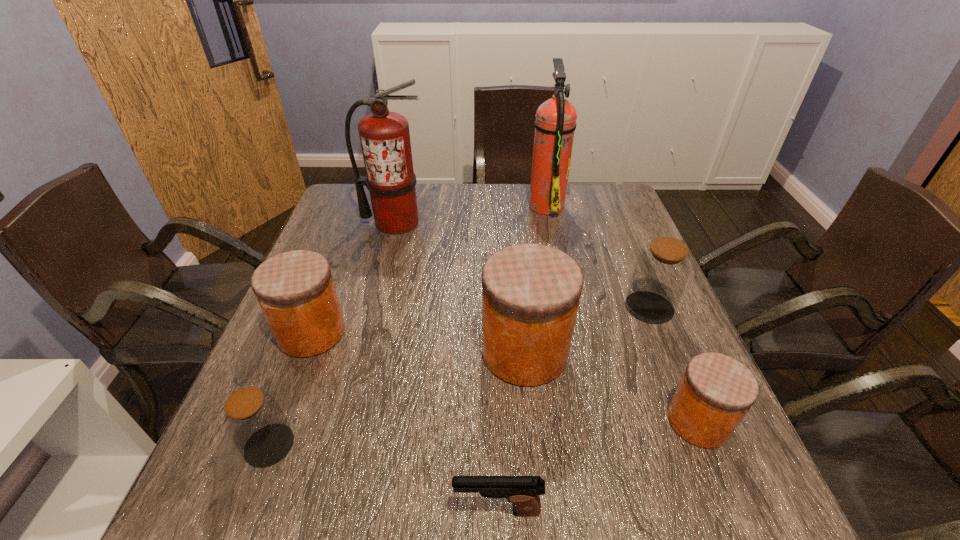
At what (x,y) coordinates should I click in order to perform the action: click on unoccupied position between the black pistol and the nearest orange jar. Please return your answer as a coordinate pair (x, y). Looking at the image, I should click on (598, 466).

The image size is (960, 540). Identify the location of vacant area that lies between the bigger brown jar and the smaller brown jar. (459, 376).

This screenshot has height=540, width=960. I want to click on free space between the right fire extinguisher and the left brown jar, so click(408, 325).

Identify the location of object identified as the closest to the biggest orange jar. (661, 272).

Identify which object is the seventh nearest to the smallest orange jar. Please provide its 2D coordinates. Your answer should be formatted as a tuple, i.e. [(x, y)], where the tuple contains the x and y coordinates of a point satisfying the conditions above.

[(385, 138)]

Identify which jar is the fourth closest to the smaller brown jar. Please provide its 2D coordinates. Your answer should be formatted as a tuple, i.e. [(x, y)], where the tuple contains the x and y coordinates of a point satisfying the conditions above.

[(661, 272)]

Identify the location of jar that is the fourth nearest to the second biggest orange jar. This screenshot has width=960, height=540. (716, 391).

Identify which orange jar is located as the second nearest to the right fire extinguisher. Please provide its 2D coordinates. Your answer should be formatted as a tuple, i.e. [(x, y)], where the tuple contains the x and y coordinates of a point satisfying the conditions above.

[(295, 290)]

Image resolution: width=960 pixels, height=540 pixels. I want to click on orange jar that stands as the third closest to the smaller brown jar, so click(716, 391).

At what (x,y) coordinates should I click in order to perform the action: click on vacant region that satisfies the following two spatial constraints: 1. on the front side of the biggest orange jar; 2. at the barrel of the pistol. Please return your answer as a coordinate pair (x, y). The height and width of the screenshot is (540, 960). Looking at the image, I should click on (540, 510).